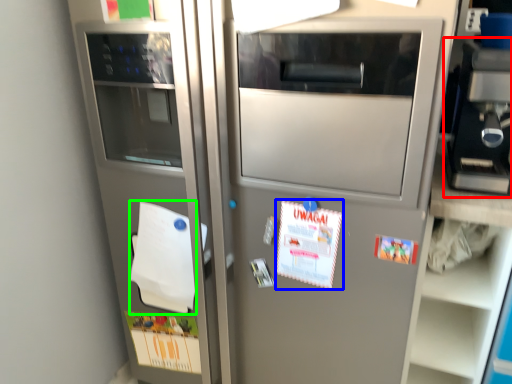
Question: Which object is the farthest from appliance (highlighted by a red box)? Choose among these: postcard (highlighted by a blue box) or notepad (highlighted by a green box).

Choices:
 (A) postcard
 (B) notepad

Answer: (B)